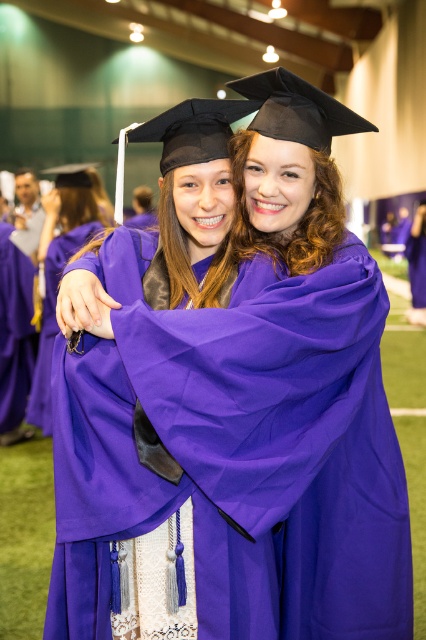
Question: Does matte purple gown at center appear under purple matte graduation robe at center?

Choices:
 (A) no
 (B) yes

Answer: (A)

Question: Considering the relative positions of matte purple gown at center and purple matte graduation robe at center in the image provided, where is matte purple gown at center located with respect to purple matte graduation robe at center?

Choices:
 (A) below
 (B) above

Answer: (B)

Question: Which point is farther to the camera?

Choices:
 (A) (17, 330)
 (B) (58, 195)

Answer: (A)

Question: Which object appears farthest from the camera in this image?

Choices:
 (A) matte purple gown at center
 (B) purple matte graduation robe at center

Answer: (B)

Question: Does matte purple gown at center lie behind purple matte graduation robe at center?

Choices:
 (A) no
 (B) yes

Answer: (A)